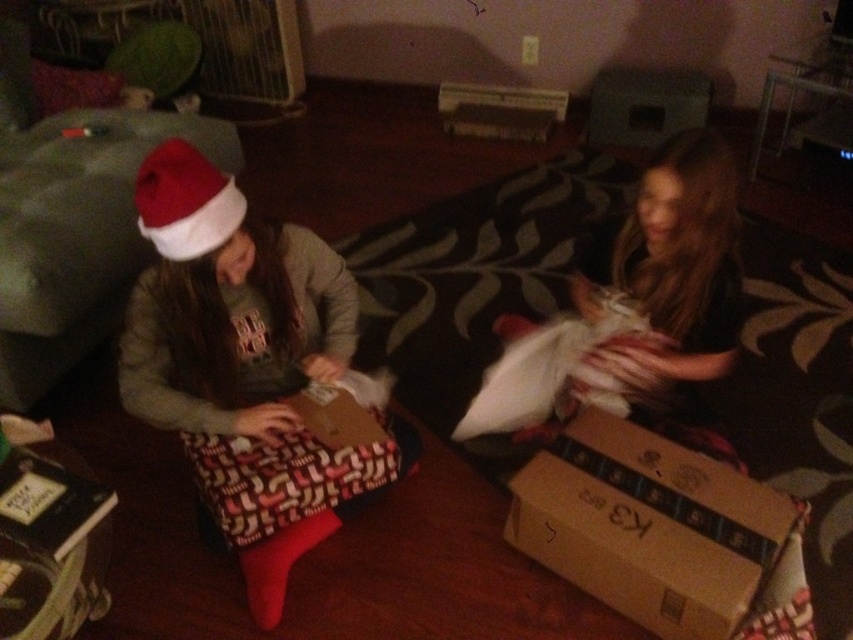
In the image, there is a white fluffy pillow at right. Could you tell me its exact 2D coordinates?

The white fluffy pillow at right is located at the 2D coordinates of point (642,305).